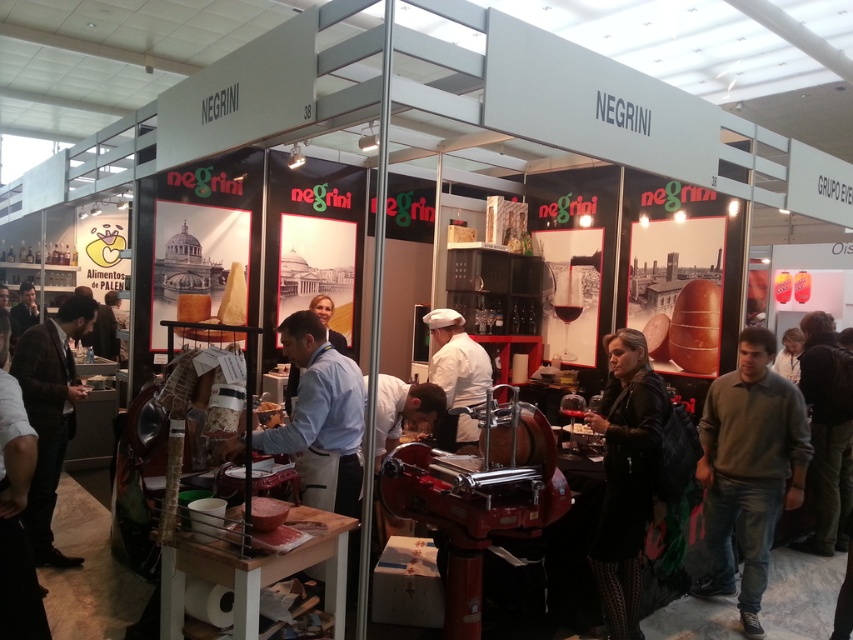
Is black leather jacket at center taller than brown wool jacket at lower left?

No.

Is point (660, 394) positioned behind point (45, 468)?

No, (660, 394) is in front of (45, 468).

Locate an element on the screen. The height and width of the screenshot is (640, 853). black leather jacket at center is located at coordinates (625, 476).

Locate an element on the screen. Image resolution: width=853 pixels, height=640 pixels. brown wool jacket at lower left is located at coordinates (50, 413).

Which is in front, point (85, 396) or point (831, 424)?

Point (85, 396)

Where is `brown wool jacket at lower left`? The image size is (853, 640). brown wool jacket at lower left is located at coordinates (50, 413).

Which of these two, gray sweater at right or brown wool jacket at lower left, stands taller?

Standing taller between the two is brown wool jacket at lower left.

Between gray sweater at right and brown wool jacket at lower left, which one is positioned higher?

brown wool jacket at lower left is higher up.

Is point (798, 396) closer to camera compared to point (32, 348)?

Yes.

At what (x,y) coordinates should I click in order to perform the action: click on gray sweater at right. Please return your answer as a coordinate pair (x, y). Looking at the image, I should click on tap(749, 468).